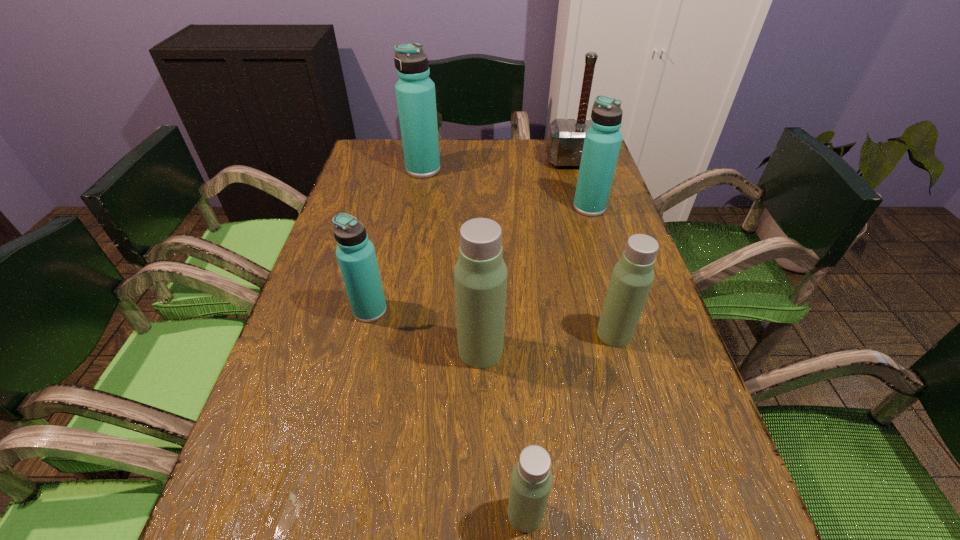
This screenshot has height=540, width=960. What are the coordinates of `vacant space located on the front of the biggest aqua thermos bottle` in the screenshot? It's located at (407, 258).

You are a GUI agent. You are given a task and a screenshot of the screen. Output one action in this format:
    pyautogui.click(x=<x>, y=<y>)
    Task: Click on the vacant space located on the front of the brown hammer
    This screenshot has width=960, height=540.
    Given the screenshot: What is the action you would take?
    pyautogui.click(x=594, y=226)

Find the location of a particular element. vacant space located 0.250m on the front of the fifth nearest object is located at coordinates (612, 282).

Find the location of a particular element. blank space located 0.060m on the left of the biggest light thermos bottle is located at coordinates tap(428, 350).

Locate an element on the screen. This screenshot has height=540, width=960. free region located on the right of the nearest aqua thermos bottle is located at coordinates (540, 310).

The height and width of the screenshot is (540, 960). In order to click on vacant area situated 0.270m on the front of the rightmost light thermos bottle in this screenshot , I will do `click(658, 490)`.

Locate an element on the screen. vacant space located on the left of the nearest thermos bottle is located at coordinates (245, 514).

Identify the location of thermos bottle situated at the far edge. This screenshot has height=540, width=960. (415, 91).

Find the location of a particular element. hammer located at the far edge is located at coordinates (565, 140).

Locate an element on the screen. hammer positioned at the right edge is located at coordinates (565, 140).